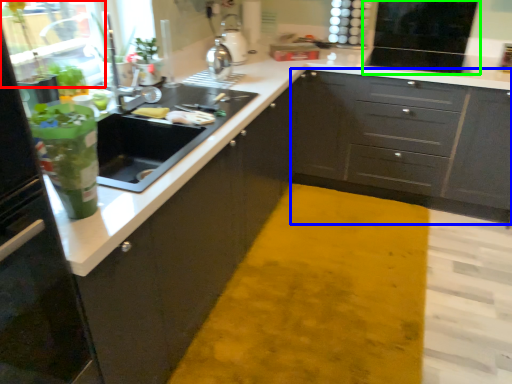
Question: Which object is the closest to the glass door (highlighted by a red box)? Choose among these: cabinetry (highlighted by a blue box) or appliance (highlighted by a green box).

Choices:
 (A) cabinetry
 (B) appliance

Answer: (A)